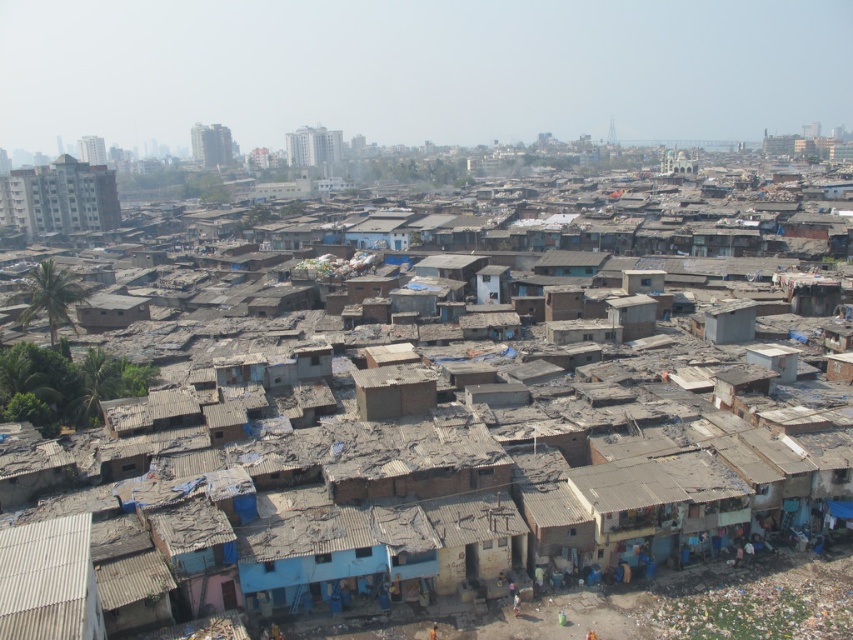
You are a drone operator flying a drone over an urban area. You need to capture a photo of both point (83, 216) and point (386, 388). Which point should you fly closer to first to ensure both points are in frame?

You should fly closer to point (386, 388) first because it is closer to the camera than point (83, 216). This way, when you adjust the camera angle or move towards point (83, 216), both points will remain in frame more easily.